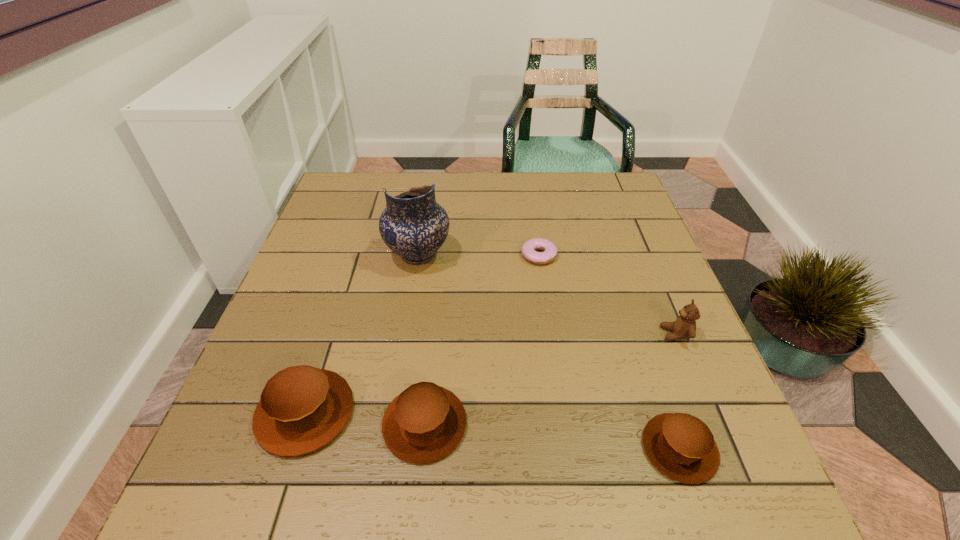
This screenshot has height=540, width=960. In order to click on the leftmost muffin in this screenshot , I will do `click(302, 408)`.

Locate an element on the screen. The image size is (960, 540). the second muffin from left to right is located at coordinates (426, 422).

The height and width of the screenshot is (540, 960). I want to click on the rightmost muffin, so coord(681,446).

Where is `the fifth tallest object`? The height and width of the screenshot is (540, 960). the fifth tallest object is located at coordinates (681, 446).

You are a GUI agent. You are given a task and a screenshot of the screen. Output one action in this format:
    pyautogui.click(x=<x>, y=<y>)
    Task: Click on the pottery
    This screenshot has height=540, width=960.
    Given the screenshot: What is the action you would take?
    pyautogui.click(x=413, y=225)

You are a GUI agent. You are given a task and a screenshot of the screen. Output one action in this format:
    pyautogui.click(x=<x>, y=<y>)
    Task: Click on the shortest object
    The height and width of the screenshot is (540, 960).
    Given the screenshot: What is the action you would take?
    pyautogui.click(x=550, y=250)

Locate an element on the screen. Image resolution: width=960 pixels, height=540 pixels. doughnut is located at coordinates (550, 250).

In order to click on teddy bear in this screenshot , I will do `click(684, 327)`.

The height and width of the screenshot is (540, 960). I want to click on free point located 0.150m on the back of the leftmost muffin, so click(x=336, y=315).

Where is `free space located 0.330m on the right of the second tallest muffin`? This screenshot has width=960, height=540. free space located 0.330m on the right of the second tallest muffin is located at coordinates (652, 424).